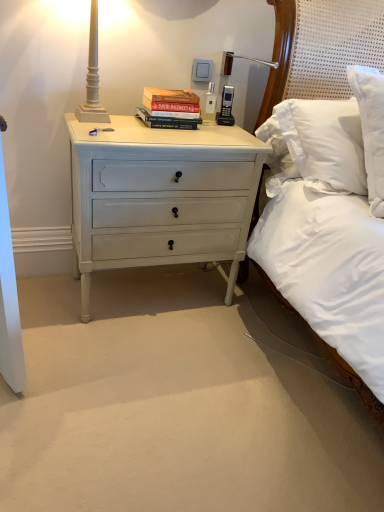
Describe the element at coordinates (92, 77) in the screenshot. I see `matte white lamp at upper left` at that location.

Where is `hardcover books at center`? hardcover books at center is located at coordinates (170, 108).

This screenshot has width=384, height=512. I want to click on matte white lamp at upper left, so click(92, 77).

I want to click on bedside lamp that is on the left side of hardcover books at center, so click(92, 77).

Which is more to the right, matte white lamp at upper left or hardcover books at center?

From the viewer's perspective, hardcover books at center appears more on the right side.

Does matte white lamp at upper left have a lesser width compared to hardcover books at center?

No, matte white lamp at upper left is not thinner than hardcover books at center.

Could you tell me if matte white lamp at upper left is facing hardcover books at center?

No, matte white lamp at upper left is not oriented towards hardcover books at center.

Does point (94, 60) come farther from viewer compared to point (173, 204)?

That is False.

Could you tell me if matte white lamp at upper left is turned towards white painted wood nightstand at lower left?

No, matte white lamp at upper left does not turn towards white painted wood nightstand at lower left.

From a real-world perspective, relative to hardcover books at center, is white painted wood nightstand at lower left vertically above or below?

In terms of real-world spatial position, white painted wood nightstand at lower left is below hardcover books at center.

Is white painted wood nightstand at lower left looking in the opposite direction of hardcover books at center?

white painted wood nightstand at lower left is not turned away from hardcover books at center.

Considering the sizes of white painted wood nightstand at lower left and hardcover books at center in the image, is white painted wood nightstand at lower left wider or thinner than hardcover books at center?

Considering their sizes, white painted wood nightstand at lower left looks broader than hardcover books at center.

Which of these two, white painted wood nightstand at lower left or hardcover books at center, stands shorter?

hardcover books at center.

Which point is more distant from viewer, [175,110] or [203,214]?

Positioned behind is point [203,214].

From the image's perspective, does hardcover books at center appear higher than white painted wood nightstand at lower left?

Correct, hardcover books at center appears higher than white painted wood nightstand at lower left in the image.

Based on the photo, how different are the orientations of hardcover books at center and white painted wood nightstand at lower left in degrees?

The angle between the facing direction of hardcover books at center and the facing direction of white painted wood nightstand at lower left is 0.566 degrees.

From the picture: Between hardcover books at center and white painted wood nightstand at lower left, which one appears on the right side from the viewer's perspective?

hardcover books at center is more to the right.

Is hardcover books at center smaller than matte white lamp at upper left?

Yes.

Based on the photo, is hardcover books at center in front of matte white lamp at upper left?

No, hardcover books at center is further to the viewer.

Is hardcover books at center oriented towards matte white lamp at upper left?

No, hardcover books at center is not oriented towards matte white lamp at upper left.

Image resolution: width=384 pixels, height=512 pixels. In order to click on bedside lamp that appears in front of the white painted wood nightstand at lower left in this screenshot , I will do `click(92, 77)`.

Consider the image. From a real-world perspective, is white painted wood nightstand at lower left physically below matte white lamp at upper left?

Correct, in the physical world, white painted wood nightstand at lower left is lower than matte white lamp at upper left.

Are white painted wood nightstand at lower left and matte white lamp at upper left located far from each other?

white painted wood nightstand at lower left is near matte white lamp at upper left, not far away.

The image size is (384, 512). I want to click on bedside lamp in front of the hardcover books at center, so click(x=92, y=77).

The image size is (384, 512). I want to click on nightstand below the matte white lamp at upper left (from the image's perspective), so 160,196.

Looking at the image, which one is located closer to hardcover books at center, white painted wood nightstand at lower left or matte white lamp at upper left?

Based on the image, matte white lamp at upper left appears to be nearer to hardcover books at center.

Estimate the real-world distances between objects in this image. Which object is closer to white painted wood nightstand at lower left, hardcover books at center or matte white lamp at upper left?

hardcover books at center.

Looking at the image, which one is located further to hardcover books at center, matte white lamp at upper left or white painted wood nightstand at lower left?

Among the two, white painted wood nightstand at lower left is located further to hardcover books at center.

Considering their positions, is white painted wood nightstand at lower left positioned further to matte white lamp at upper left than hardcover books at center?

white painted wood nightstand at lower left.

When comparing their distances from matte white lamp at upper left, does hardcover books at center or white painted wood nightstand at lower left seem closer?

hardcover books at center is positioned closer to the anchor matte white lamp at upper left.

Which object lies nearer to the anchor point white painted wood nightstand at lower left, matte white lamp at upper left or hardcover books at center?

Among the two, hardcover books at center is located nearer to white painted wood nightstand at lower left.

Locate an element on the screen. This screenshot has width=384, height=512. book between matte white lamp at upper left and white painted wood nightstand at lower left vertically is located at coordinates (170, 108).